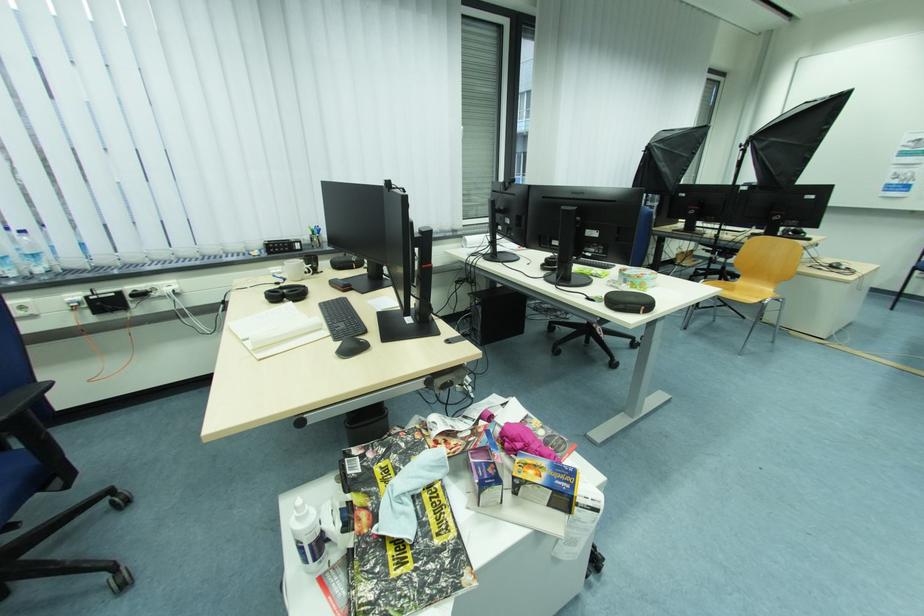
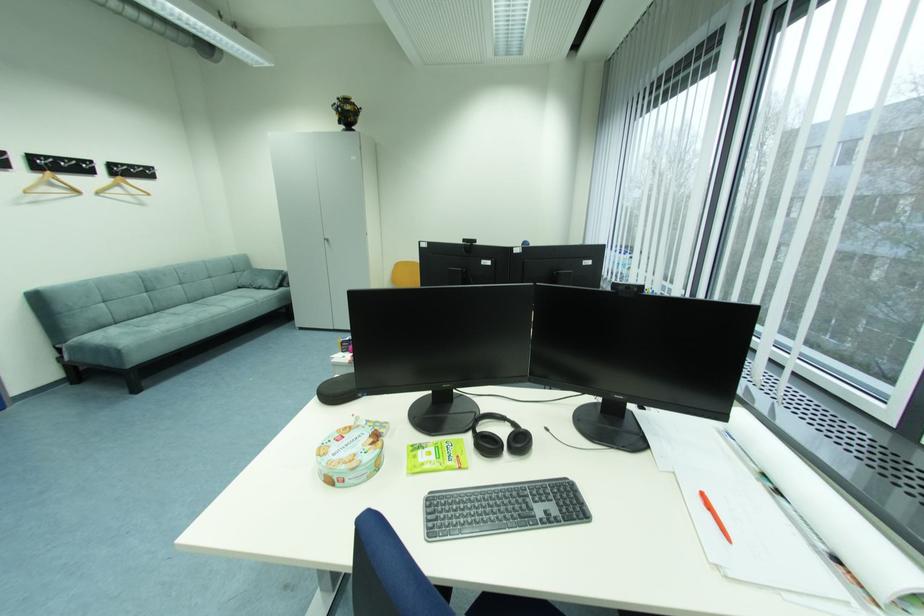
Question: I am providing you with two images of the same scene from different viewpoints. After the viewpoint changes to image2, which objects are now occluded?

Choices:
 (A) white spray bottle
 (B) clear plastic holder
 (C) round cookie tin
 (D) cabinet door handle

Answer: (A)